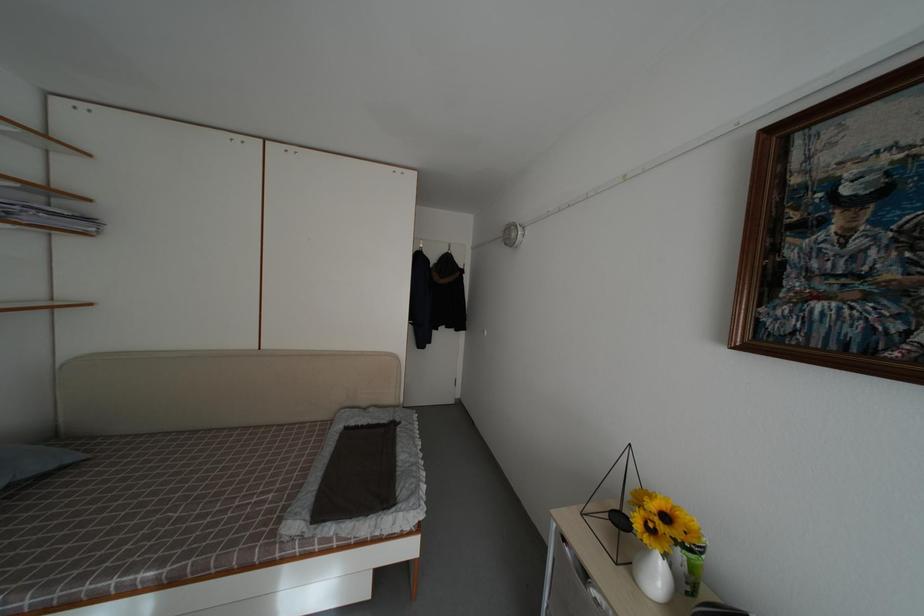
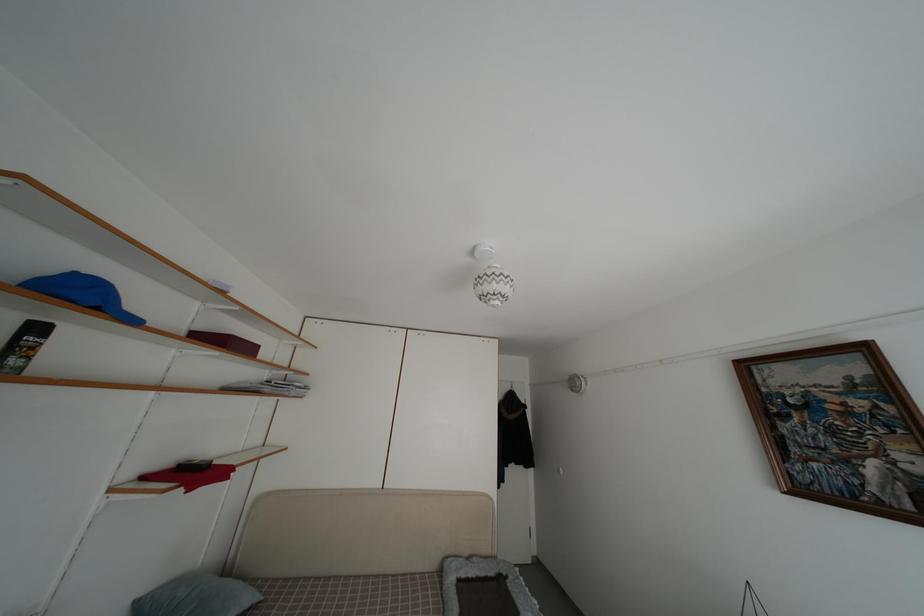
In a continuous first-person perspective shot, in which direction is the camera moving?

The cameraman walked toward left, backward.